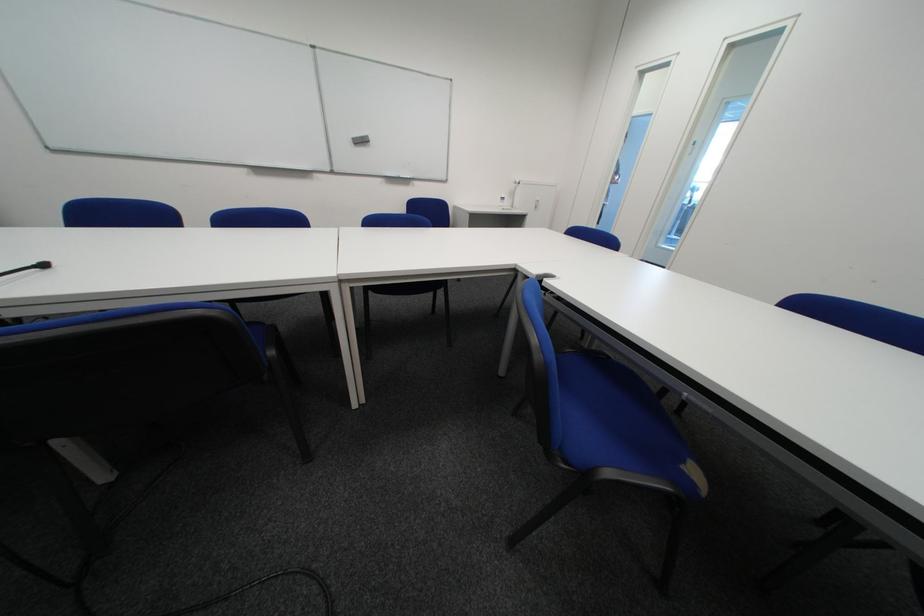
The height and width of the screenshot is (616, 924). I want to click on black microphone, so click(28, 268).